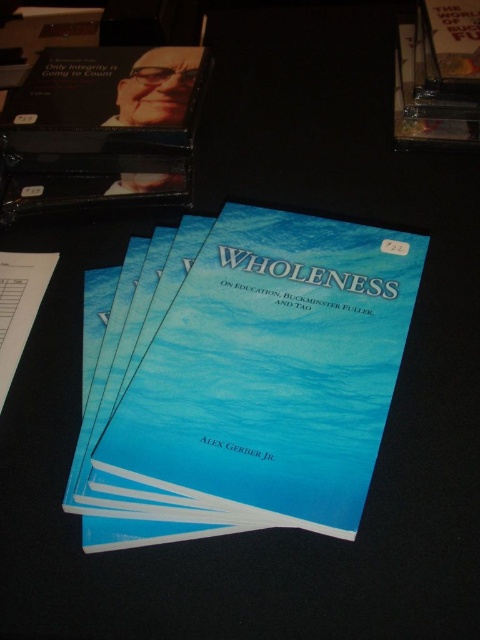
Question: Which point is closer to the camera?

Choices:
 (A) (106, 472)
 (B) (448, 138)
 (C) (149, 134)

Answer: (A)

Question: Considering the relative positions of matte black book at upper left and gold metallic book at upper right in the image provided, where is matte black book at upper left located with respect to gold metallic book at upper right?

Choices:
 (A) above
 (B) below

Answer: (B)

Question: Among these objects, which one is nearest to the camera?

Choices:
 (A) matte black book at upper left
 (B) gold metallic book at upper right

Answer: (A)

Question: Is blue paper book at center to the left of matte black book at upper left from the viewer's perspective?

Choices:
 (A) no
 (B) yes

Answer: (A)

Question: Does blue paper book at center appear on the left side of gold metallic book at upper right?

Choices:
 (A) no
 (B) yes

Answer: (B)

Question: Which point is farther to the camera?

Choices:
 (A) (436, 116)
 (B) (248, 508)

Answer: (A)